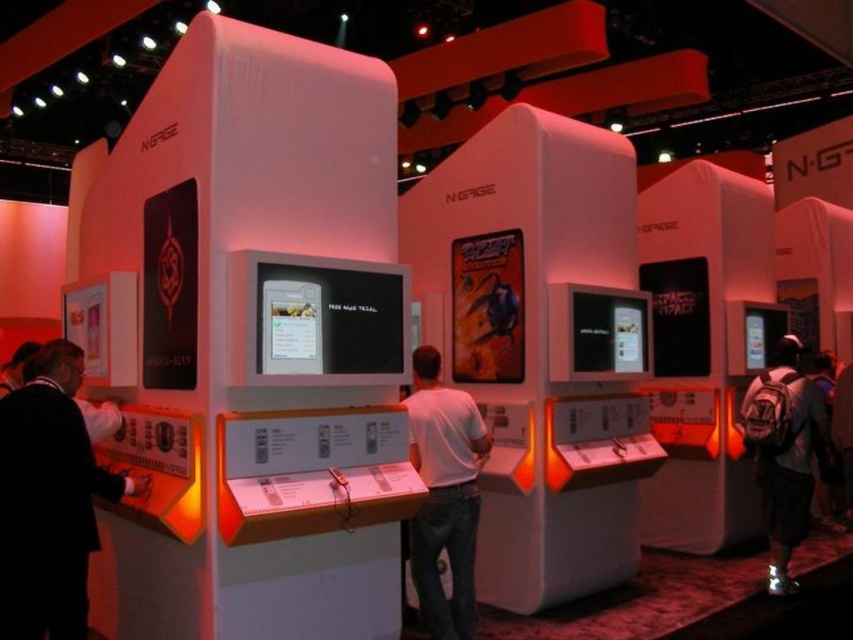
You are attending a gaming exhibition and notice a person wearing a white matte shirt at center and carrying a dark gray backpack at lower right. Which item is closer to you, the attendee?

The white matte shirt at center is closer to you because it is positioned over the dark gray backpack at lower right, indicating it is in front.

You are at the N_GAGE gaming exhibition and want to know if the black matte suit at left can fit into a storage compartment that can only hold items shorter than the dark gray backpack at lower right. Can it fit?

The black matte suit at left is shorter than the dark gray backpack at lower right, so it can fit into the storage compartment since it is shorter than the backpack.

You are at a gaming exhibition and see a black matte suit at left and a white matte shirt at center. Which one is closer to you?

The black matte suit at left is closer to you because it is in front of the white matte shirt at center.